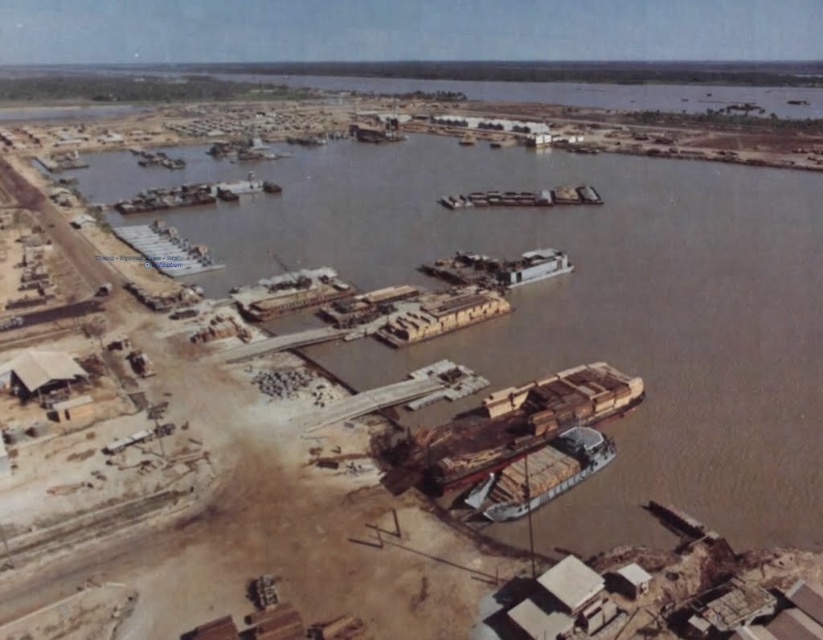
Does brown wooden dock at center have a greater height compared to wooden planks at center?

Yes, brown wooden dock at center is taller than wooden planks at center.

Does point (742, 320) come farther from viewer compared to point (138, 236)?

No.

The image size is (823, 640). What are the coordinates of `brown wooden dock at center` in the screenshot? It's located at (589, 308).

Can you confirm if wooden planks at center is bigger than wooden planks boat at center?

Yes.

Locate an element on the screen. wooden planks at center is located at coordinates (166, 248).

Between point (159, 221) and point (477, 196), which one is positioned behind?

The point (477, 196) is more distant.

At what (x,y) coordinates should I click in order to perform the action: click on wooden planks at center. Please return your answer as a coordinate pair (x, y). Image resolution: width=823 pixels, height=640 pixels. Looking at the image, I should click on (166, 248).

Does wooden planks boat at lower center have a greater width compared to wooden planks boat at center?

No, wooden planks boat at lower center is not wider than wooden planks boat at center.

The width and height of the screenshot is (823, 640). What are the coordinates of `wooden planks boat at lower center` in the screenshot? It's located at (540, 474).

Between point (533, 484) and point (533, 192), which one is positioned in front?

Positioned in front is point (533, 484).

Where is `wooden planks boat at lower center`? The width and height of the screenshot is (823, 640). wooden planks boat at lower center is located at coordinates (540, 474).